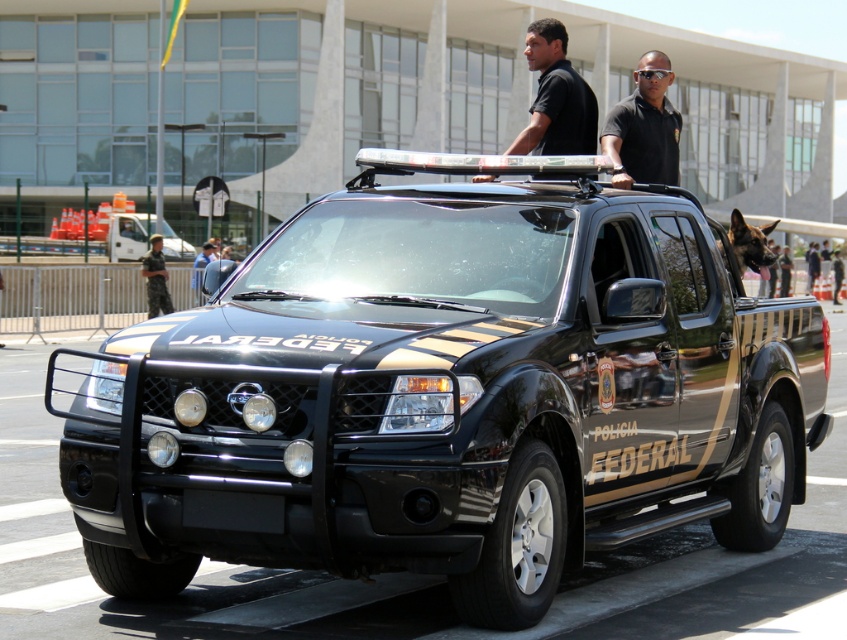
Does black matte truck at center appear under black fur dog at rear right?

Correct, black matte truck at center is located below black fur dog at rear right.

Between point (671, 346) and point (745, 262), which one is positioned behind?

The point (745, 262) is more distant.

Describe the element at coordinates (447, 392) in the screenshot. The image size is (847, 640). I see `black matte truck at center` at that location.

Identify the location of black matte truck at center. (447, 392).

Is black smooth shirt at upper center taller than black uniformed man at center?

Correct, black smooth shirt at upper center is much taller as black uniformed man at center.

Describe the element at coordinates (555, 97) in the screenshot. This screenshot has height=640, width=847. I see `black smooth shirt at upper center` at that location.

Which is behind, point (557, 92) or point (809, 262)?

The point (809, 262) is more distant.

In order to click on black smooth shirt at upper center in this screenshot , I will do `click(555, 97)`.

Does point (666, 120) come farther from viewer compared to point (817, 273)?

No, (666, 120) is in front of (817, 273).

Is black matte shirt at upper center to the right of black uniformed man at center from the viewer's perspective?

In fact, black matte shirt at upper center is to the left of black uniformed man at center.

The height and width of the screenshot is (640, 847). Identify the location of black matte shirt at upper center. (645, 128).